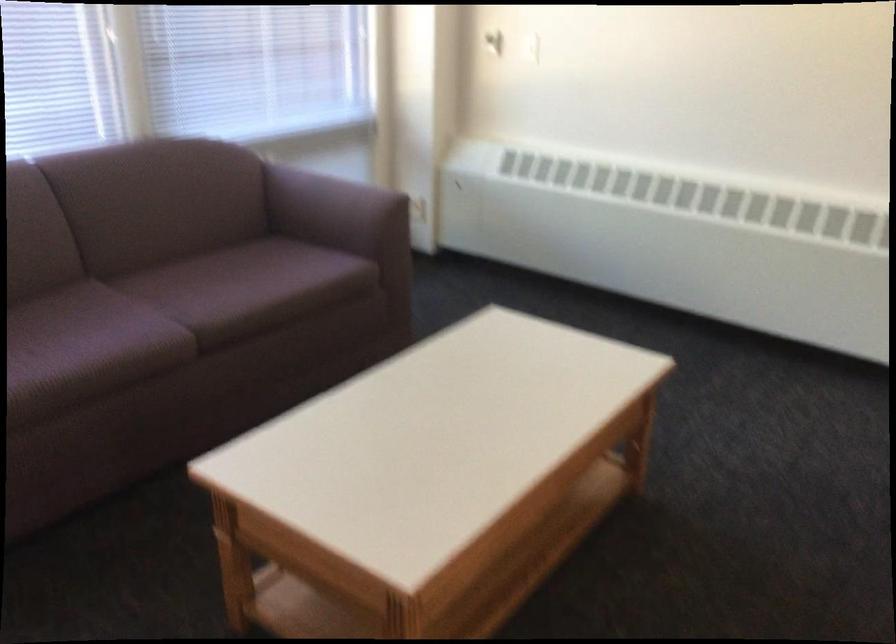
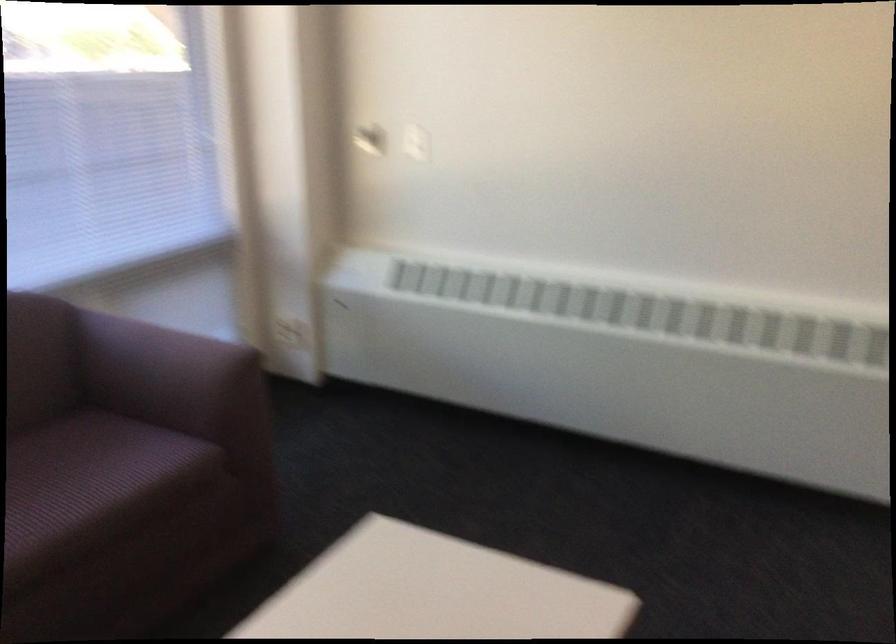
Question: What movement of the cameraman would produce the second image?

Choices:
 (A) Left
 (B) Right
 (C) Forward
 (D) Backward

Answer: (C)